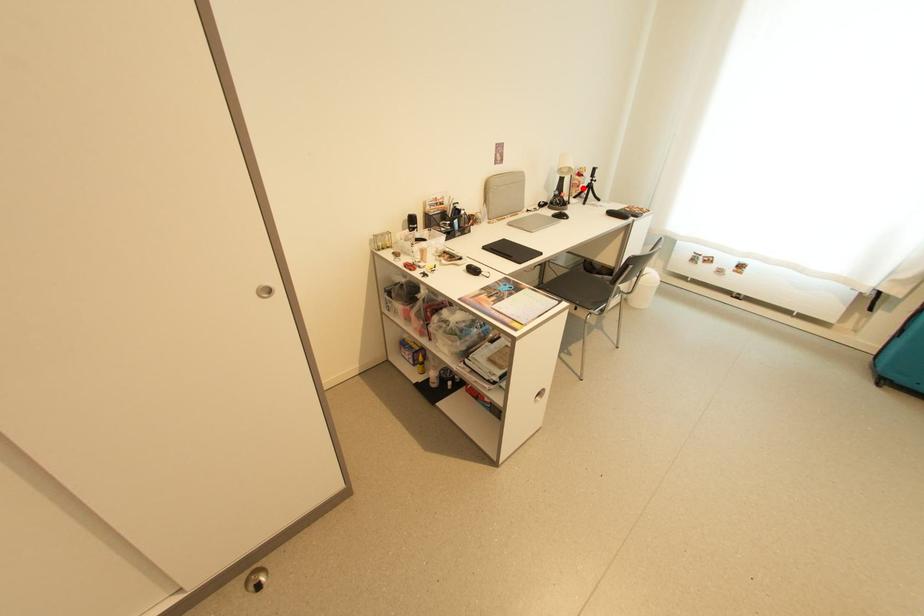
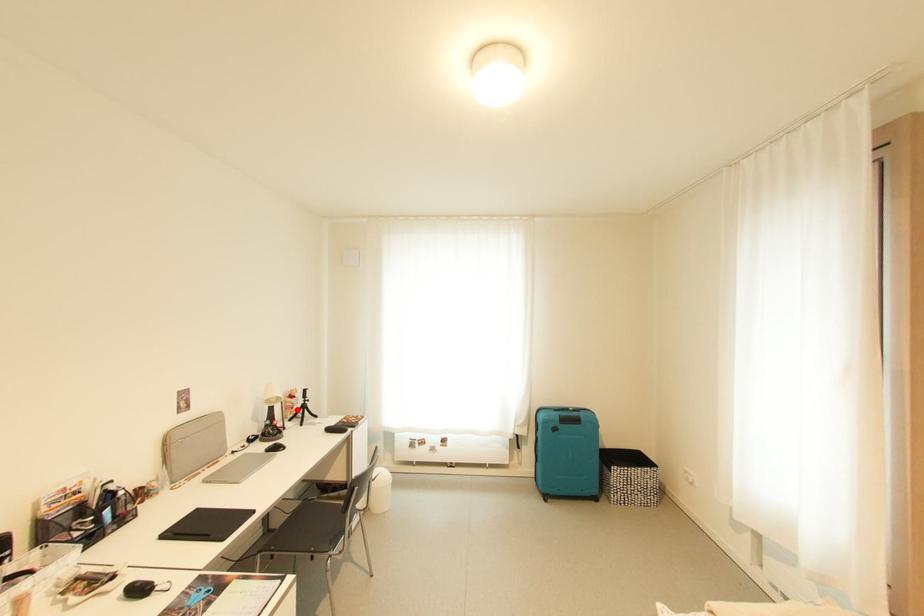
I am providing you with two images of the same scene from different viewpoints. A red point is marked on the first image and another point is marked on the second image. Are the points marked in image1 and image2 representing the same 3D position?

Yes